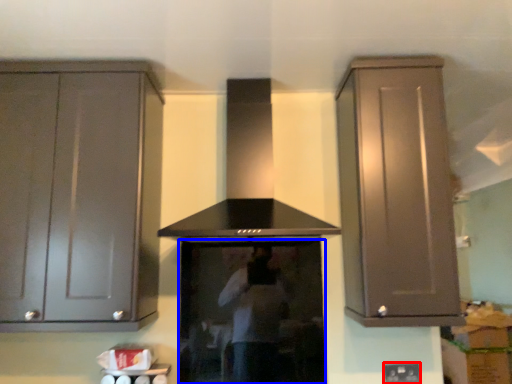
Question: Which object is closer to the camera taking this photo, electric outlet (highlighted by a red box) or appliance (highlighted by a blue box)?

Choices:
 (A) electric outlet
 (B) appliance

Answer: (B)